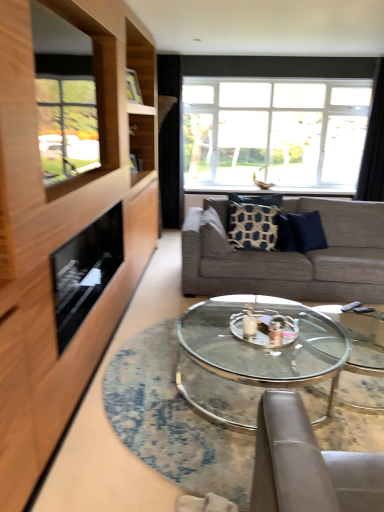
Question: From a real-world perspective, is transparent glass table at center physically located above or below black glass fireplace at left?

Choices:
 (A) below
 (B) above

Answer: (A)

Question: Relative to black glass fireplace at left, is transparent glass table at center in front or behind?

Choices:
 (A) front
 (B) behind

Answer: (A)

Question: Based on their relative distances, which object is farther from the black fabric curtain at upper center, marked as the first curtain in a left-to-right arrangement?

Choices:
 (A) clear glass window at upper center
 (B) transparent glass coffee table at center
 (C) wooden frame at left
 (D) transparent glass table at center
 (E) patterned fabric pillow at center, positioned as the 2th pillow in right-to-left order

Answer: (D)

Question: Estimate the real-world distances between objects in this image. Which object is closer to the clear glass window at upper center?

Choices:
 (A) blue textured pillow at center, the second pillow in the left-to-right sequence
 (B) transparent glass table at center
 (C) black fabric curtain at upper center, the 2th curtain when ordered from right to left
 (D) patterned fabric pillow at center, marked as the first pillow in a left-to-right arrangement
 (E) textured gray couch at center

Answer: (C)